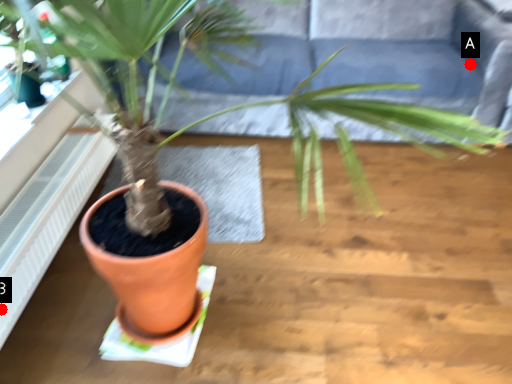
Question: Two points are circled on the image, labeled by A and B beside each circle. Which point appears closest to the camera in this image?

Choices:
 (A) A is closer
 (B) B is closer

Answer: (B)